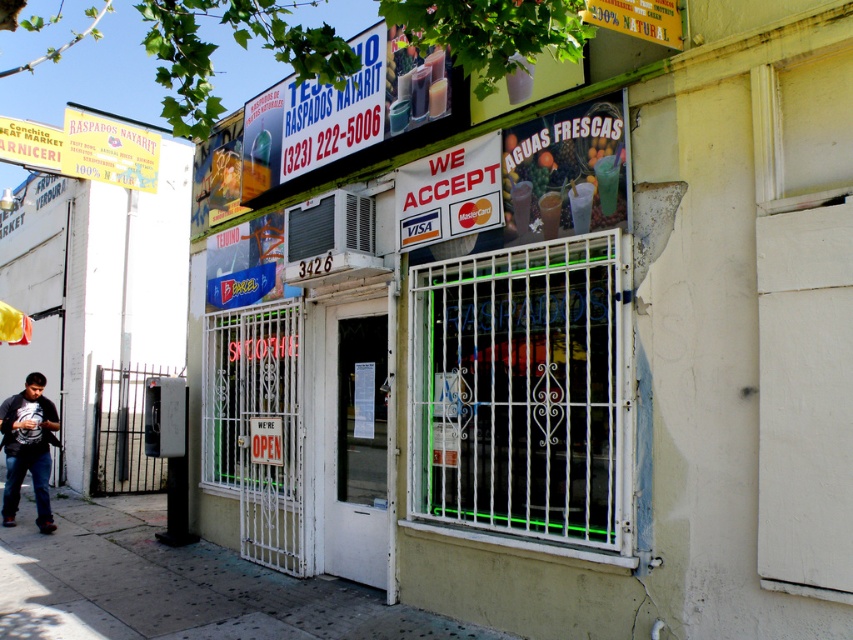
Question: Which of the following is the farthest from the observer?

Choices:
 (A) gray concrete sidewalk at lower left
 (B) dark gray cotton shirt at lower left

Answer: (B)

Question: Which object is farther from the camera taking this photo?

Choices:
 (A) gray concrete sidewalk at lower left
 (B) dark gray cotton shirt at lower left

Answer: (B)

Question: Is the position of gray concrete sidewalk at lower left more distant than that of dark gray cotton shirt at lower left?

Choices:
 (A) yes
 (B) no

Answer: (B)

Question: Is the position of gray concrete sidewalk at lower left more distant than that of dark gray cotton shirt at lower left?

Choices:
 (A) no
 (B) yes

Answer: (A)

Question: Is gray concrete sidewalk at lower left closer to the viewer compared to dark gray cotton shirt at lower left?

Choices:
 (A) yes
 (B) no

Answer: (A)